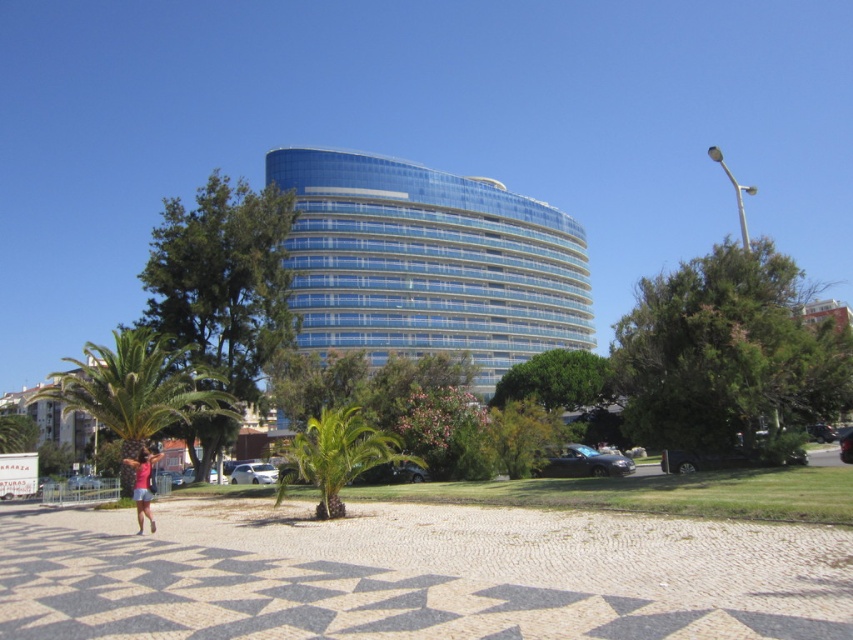
You are standing at the point with coordinates point (x=428, y=262) in the image. What object are you facing?

The point (x=428, y=262) corresponds to the blue glass building at center, so you are facing the blue glass building at center.

You are a photographer planning to take a picture of the blue glass building at center and the pink fabric at lower left. Which object should you focus on first if you want to capture both in a single shot without moving the camera?

The blue glass building at center is positioned over the pink fabric at lower left, so focusing on the blue glass building at center will ensure both are in the frame since it is closer to the camera.

You are a drone operator trying to capture aerial footage of the blue glass building at center and the green leafy palm tree at center. Which object should you focus on first if you want to start filming from the ground up?

The green leafy palm tree at center should be focused on first because the blue glass building at center is above it, so starting from the ground would naturally begin with the palm tree before moving upwards to the building.